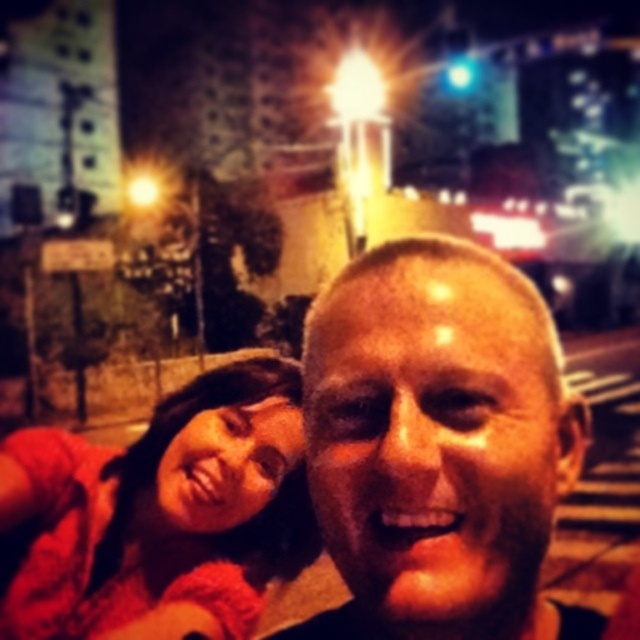
Describe the element at coordinates (438, 445) in the screenshot. I see `smooth skin face at center` at that location.

Is smooth skin face at center taller than matte red shirt at lower left?

Yes, smooth skin face at center is taller than matte red shirt at lower left.

Who is more forward, [452,388] or [163,577]?

Point [452,388] is more forward.

In order to click on smooth skin face at center in this screenshot , I will do `click(438, 445)`.